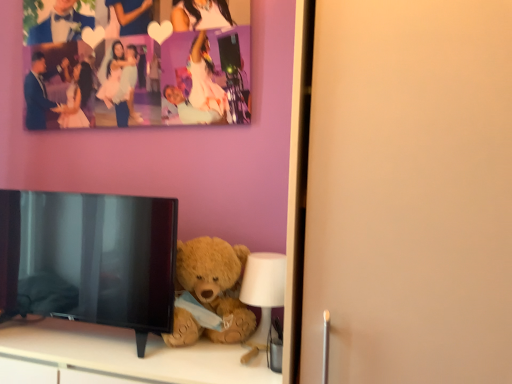
The width and height of the screenshot is (512, 384). What are the coordinates of `vacant space in front of fuzzy brown teddy bear at lower center` in the screenshot? It's located at (204, 367).